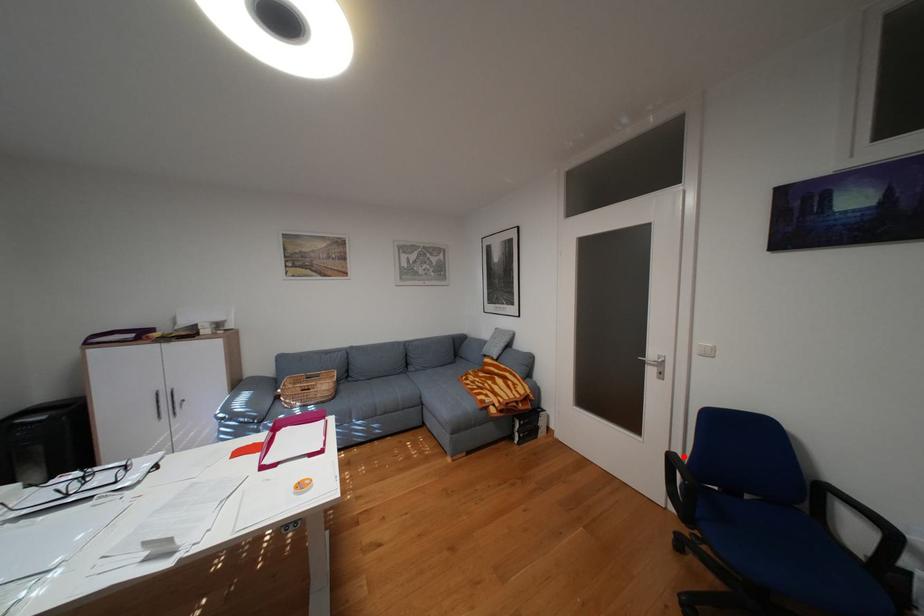
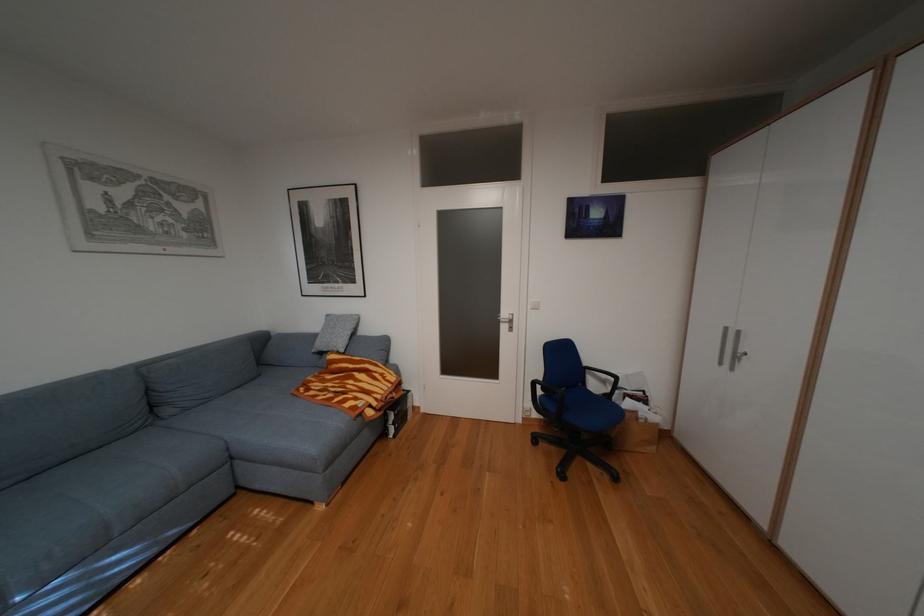
Question: I am providing you with two images of the same scene from different viewpoints. A red point is marked on the first image. Can you still see the location of the red point in image 2?

Choices:
 (A) Yes
 (B) No

Answer: (A)